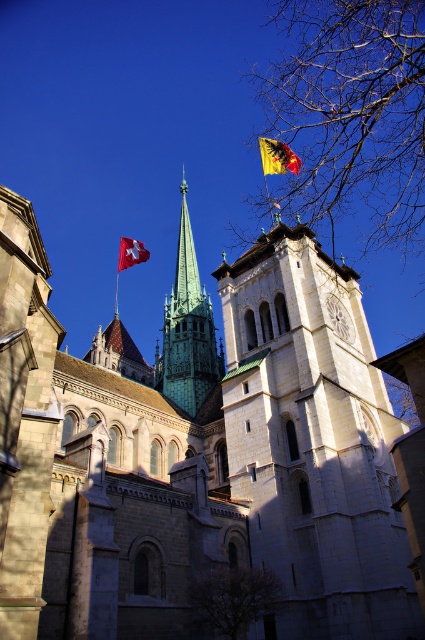
You are a tourist standing in front of the cathedral and want to take a photo that includes both the yellow fabric flag at upper center and the swiss flag at upper left. Based on their heights, which flag should you position lower in the frame to ensure both are fully visible?

The yellow fabric flag at upper center is not as tall as the swiss flag at upper left, so you should position the yellow fabric flag at upper center lower in the frame to ensure both flags are fully visible.

You are standing in front of the cathedral and want to take a photo that includes both the white stone tower at center and the green copper spire at center. Which one should you focus on first to ensure both are in frame?

You should focus on the white stone tower at center first since it is positioned below the green copper spire at center, so adjusting the camera angle to include the lower tower will naturally include the spire above it.